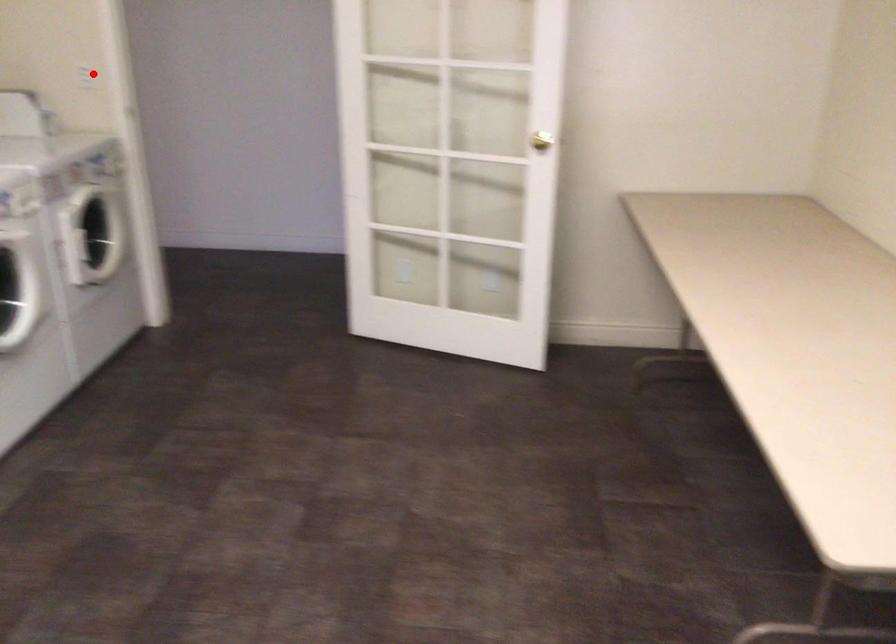
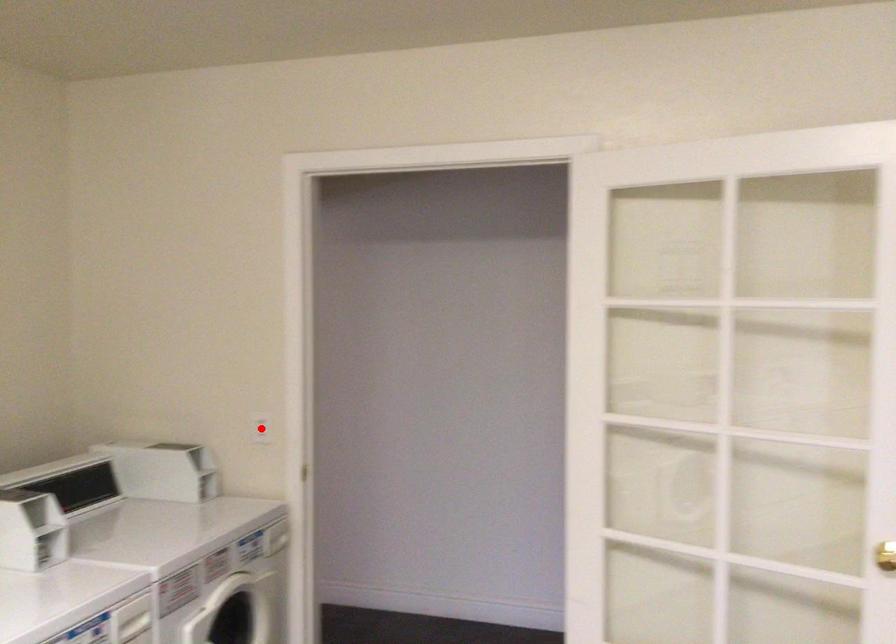
I am providing you with two images of the same scene from different viewpoints. A red point is marked on the first image and another point is marked on the second image. Are the points marked in image1 and image2 representing the same 3D position?

Yes